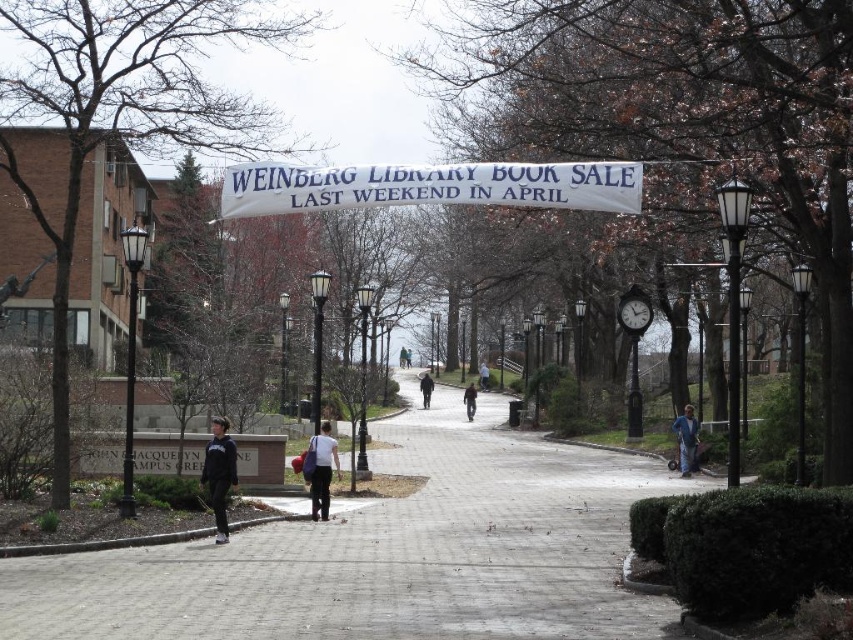
Question: Does dark brown leather jacket at center appear under dark blue jeans at center?

Choices:
 (A) yes
 (B) no

Answer: (A)

Question: Can you confirm if white fabric banner at center is positioned below dark blue hoodie at center?

Choices:
 (A) no
 (B) yes

Answer: (A)

Question: Which object is the closest to the metallic gray clock at center?

Choices:
 (A) white matte shirt at center
 (B) blue denim jacket at lower right
 (C) light blue shirt at center

Answer: (B)

Question: Which of the following is the farthest from the observer?

Choices:
 (A) (427, 371)
 (B) (622, 326)
 (C) (680, 468)

Answer: (A)

Question: Does white matte shirt at center have a smaller size compared to white cotton jacket at center?

Choices:
 (A) no
 (B) yes

Answer: (B)

Question: Which point is farther from the camera taking this photo?

Choices:
 (A) (398, 356)
 (B) (424, 397)
 (C) (480, 387)

Answer: (A)